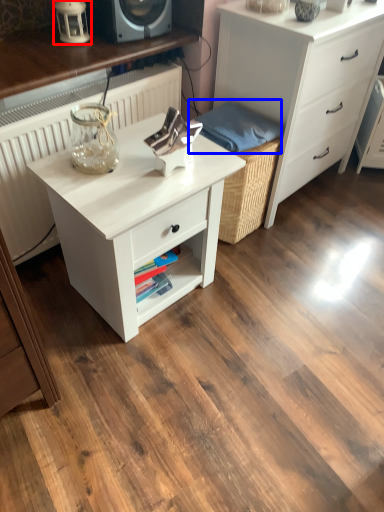
Question: Which object appears closest to the camera in this image, table lamp (highlighted by a red box) or material (highlighted by a blue box)?

Choices:
 (A) table lamp
 (B) material

Answer: (A)